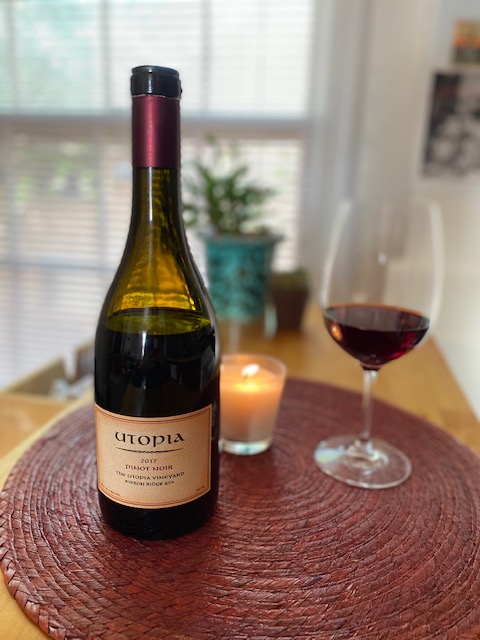
At what (x,y) coordinates should I click in order to perform the action: click on wine glass. Please return your answer as a coordinate pair (x, y). The image size is (480, 640). Looking at the image, I should click on (377, 276), (377, 292).